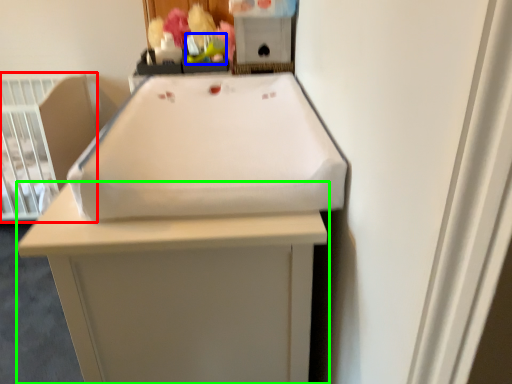
Question: Considering the real-world distances, which object is farthest from infant bed (highlighted by a red box)? toy (highlighted by a blue box) or furniture (highlighted by a green box)?

Choices:
 (A) toy
 (B) furniture

Answer: (B)